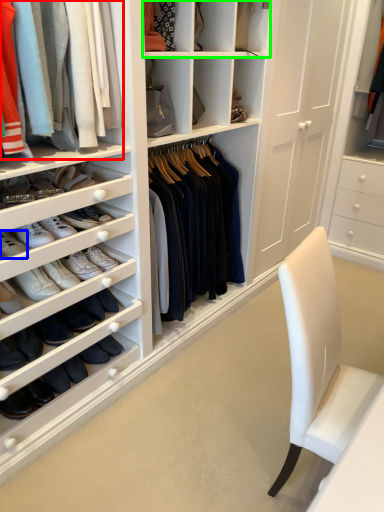
Question: Estimate the real-world distances between objects in this image. Which object is farther from clothing (highlighted by a red box), footwear (highlighted by a blue box) or shelf (highlighted by a green box)?

Choices:
 (A) footwear
 (B) shelf

Answer: (B)